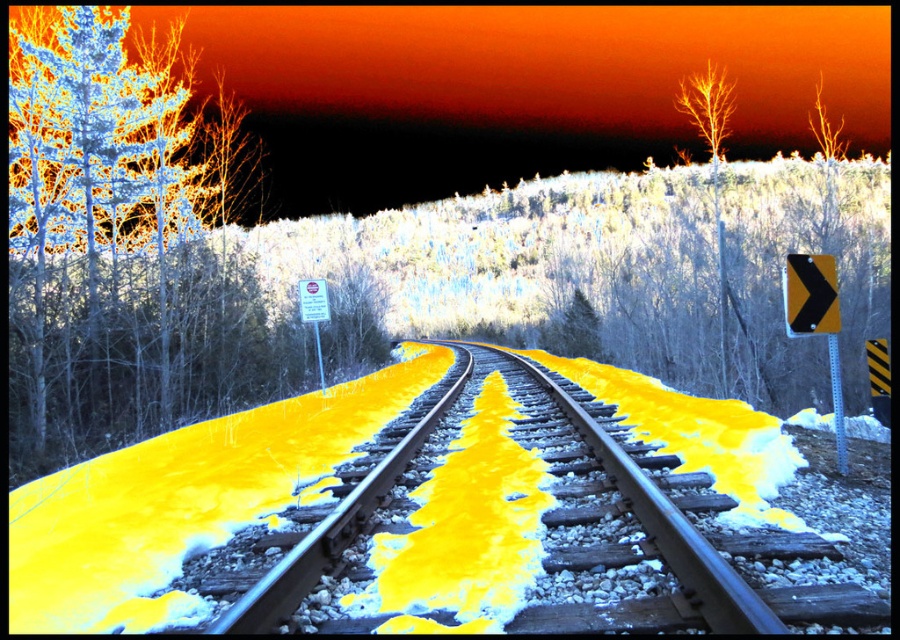
You are standing at the starting point of the railway track and want to reach the white matte tree at upper left. The railway track is 10 meters wide. Can you walk directly to the tree without crossing the tracks?

The white matte tree at upper left is 14.05 meters from viewer. Since the railway track is only 10 meters wide, the tree is beyond the track area. Therefore, you can walk directly to the tree without crossing the tracks.

You are standing at the point marked as point (120,237) in the image. Looking towards the railway tracks, can you see the white rectangular sign on the left side?

The white matte tree at upper left is located at point (120,237), so you are standing behind the tree and cannot see the white rectangular sign on the left side.